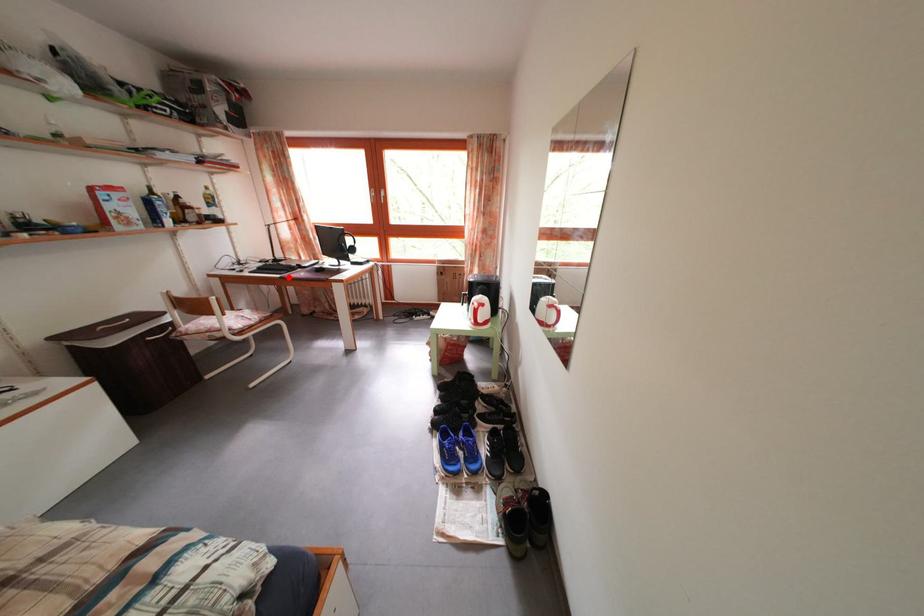
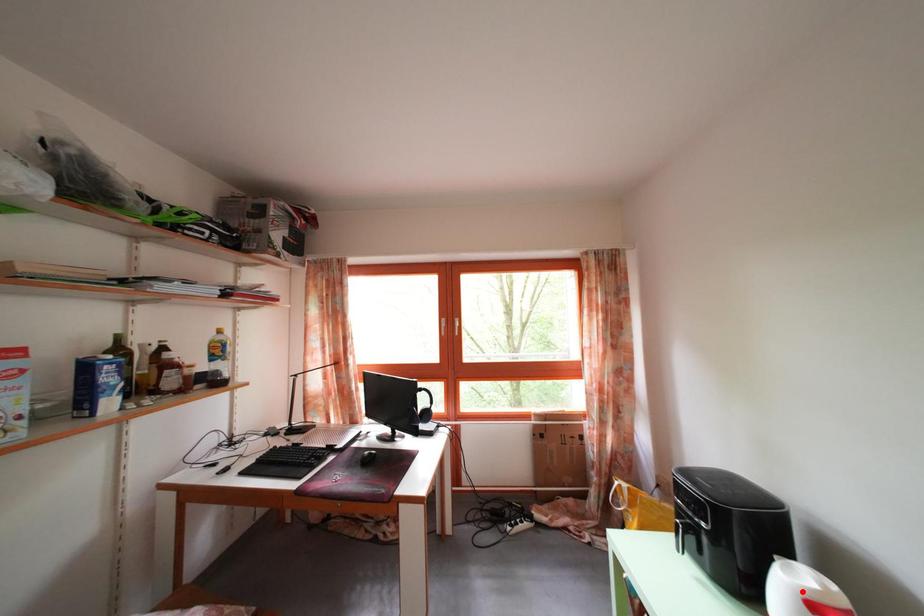
I am providing you with two images of the same scene from different viewpoints. A red point is marked on the first image and another point is marked on the second image. Is the red point in image1 aligned with the point shown in image2?

No